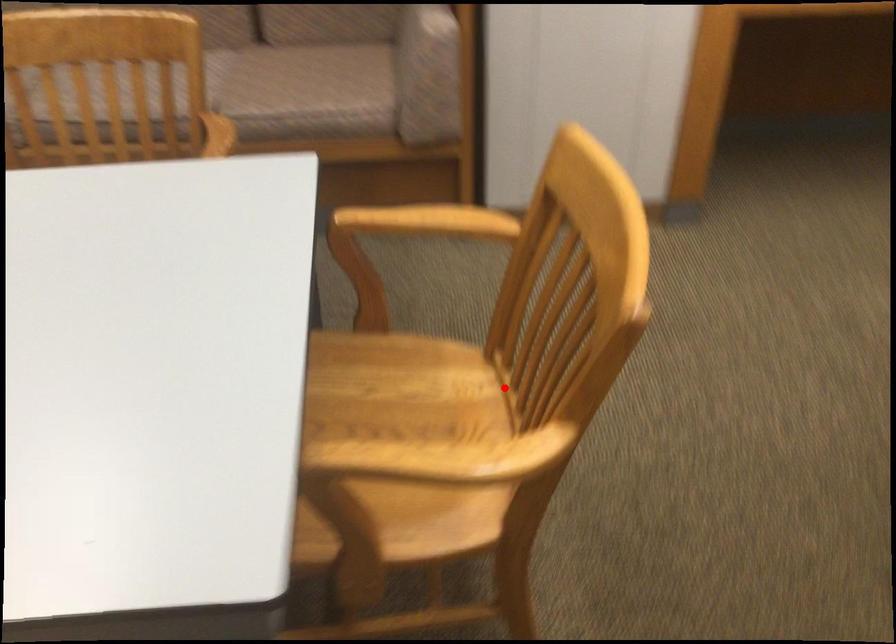
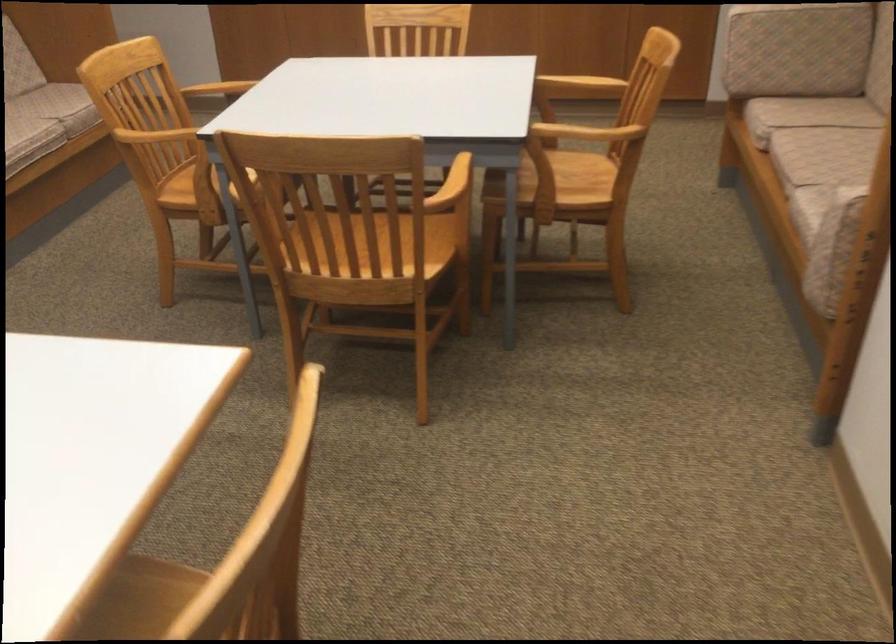
Question: I am providing you with two images of the same scene from different viewpoints. Image1 has a red point marked. In image2, the corresponding 3D location appears at what relative position? Reply with the corresponding letter.

Choices:
 (A) Closer
 (B) Farther

Answer: (B)